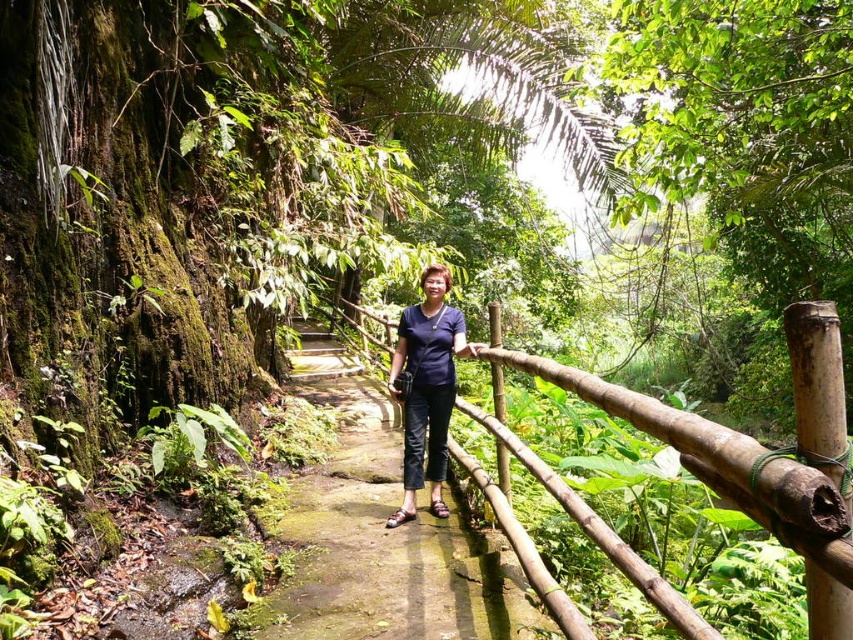
You are standing on the tropical pathway and want to place a small decorative stone at each of the two points marked in the image. The first point is at coordinates point (297, 630) and the second is at point (403, 516). Which of these points is closer to you so that you can place the stone without moving further along the path?

Point (297, 630) is closer to the viewer than point (403, 516), so you can place the decorative stone there without moving further along the path.

You are standing at the entrance of the tropical pathway and want to walk towards the green mossy stone path at center. According to the coordinates provided, in which direction should you move to reach it?

The green mossy stone path at center is located at coordinates point [387,545]. Since the coordinate system typically has [0,0] at the bottom left corner and [852,639] at the top right corner, moving towards the right and slightly upward from the entrance will lead you to the green mossy stone path at center.

You are a hiker who wants to know if the green mossy stone path at center is shorter than the blue fabric shirt at center. Can you confirm this?

The green mossy stone path at center is shorter than the blue fabric shirt at center according to the description.